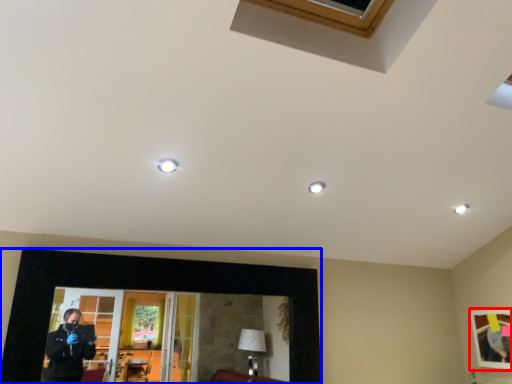
Question: Which object is further to the camera taking this photo, picture frame (highlighted by a red box) or picture frame (highlighted by a blue box)?

Choices:
 (A) picture frame
 (B) picture frame

Answer: (A)